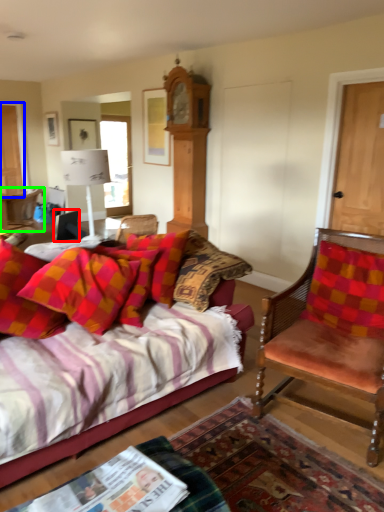
Question: Which object is the farthest from corded phone (highlighted by a red box)? Choose among these: door (highlighted by a blue box) or chair (highlighted by a green box).

Choices:
 (A) door
 (B) chair

Answer: (A)